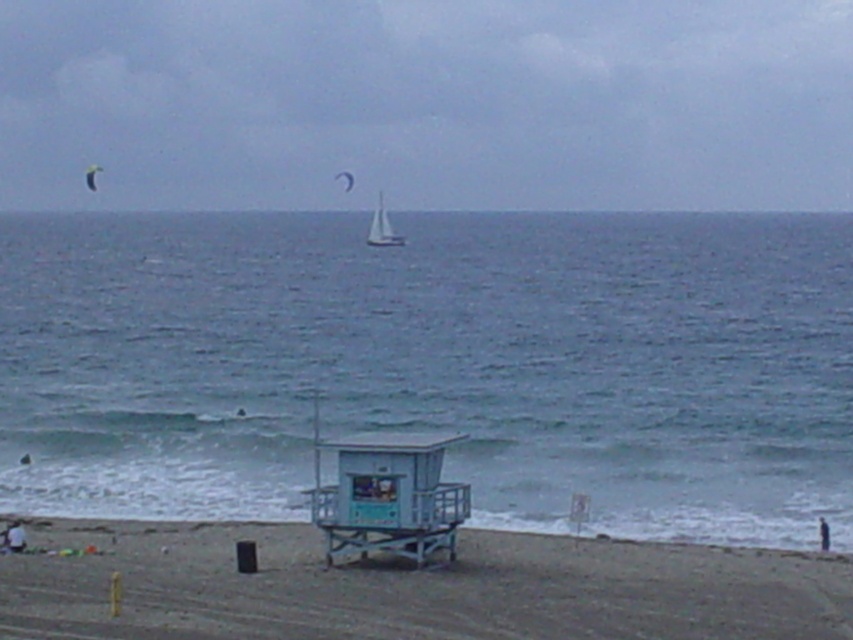
Question: Which of these objects is positioned closest to the blue water at center?

Choices:
 (A) matte white sailboat at upper center
 (B) white matte sailboat at center

Answer: (B)

Question: Is white matte sailboat at center closer to the viewer compared to dark blue fabric at lower right?

Choices:
 (A) no
 (B) yes

Answer: (A)

Question: Is blue water at center further to the viewer compared to white fabric parachute at upper left?

Choices:
 (A) yes
 (B) no

Answer: (B)

Question: Which point is farther from the camera taking this photo?

Choices:
 (A) (96, 188)
 (B) (378, 228)
 (C) (1, 536)
 (D) (328, 490)

Answer: (A)

Question: Among these objects, which one is farthest from the camera?

Choices:
 (A) blue water at center
 (B) white fabric person at lower left

Answer: (B)

Question: Does light blue wood lifeguard tower at center lie in front of white fabric person at lower left?

Choices:
 (A) yes
 (B) no

Answer: (A)